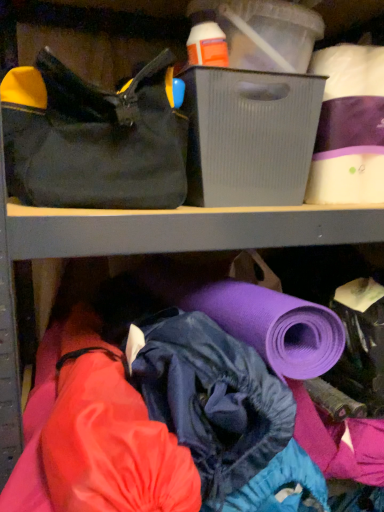
Question: Is white matte toilet paper at upper right bigger than gray ribbed plastic storage box at upper center?

Choices:
 (A) no
 (B) yes

Answer: (A)

Question: Is white matte toilet paper at upper right at the left side of gray ribbed plastic storage box at upper center?

Choices:
 (A) no
 (B) yes

Answer: (A)

Question: From a real-world perspective, is white matte toilet paper at upper right located beneath gray ribbed plastic storage box at upper center?

Choices:
 (A) no
 (B) yes

Answer: (A)

Question: Would you say white matte toilet paper at upper right is a long distance from gray ribbed plastic storage box at upper center?

Choices:
 (A) yes
 (B) no

Answer: (B)

Question: Can you confirm if white matte toilet paper at upper right is smaller than gray ribbed plastic storage box at upper center?

Choices:
 (A) yes
 (B) no

Answer: (A)

Question: Does white matte toilet paper at upper right come in front of gray ribbed plastic storage box at upper center?

Choices:
 (A) no
 (B) yes

Answer: (A)

Question: From a real-world perspective, is gray ribbed plastic storage box at upper center positioned over black canvas handbag at upper left based on gravity?

Choices:
 (A) yes
 (B) no

Answer: (B)

Question: Does gray ribbed plastic storage box at upper center have a greater height compared to black canvas handbag at upper left?

Choices:
 (A) yes
 (B) no

Answer: (B)

Question: From a real-world perspective, is gray ribbed plastic storage box at upper center located beneath black canvas handbag at upper left?

Choices:
 (A) no
 (B) yes

Answer: (B)

Question: Can you see gray ribbed plastic storage box at upper center touching black canvas handbag at upper left?

Choices:
 (A) yes
 (B) no

Answer: (B)

Question: Does gray ribbed plastic storage box at upper center have a greater width compared to black canvas handbag at upper left?

Choices:
 (A) no
 (B) yes

Answer: (A)

Question: Considering the relative sizes of gray ribbed plastic storage box at upper center and black canvas handbag at upper left in the image provided, is gray ribbed plastic storage box at upper center smaller than black canvas handbag at upper left?

Choices:
 (A) yes
 (B) no

Answer: (A)

Question: Considering the relative sizes of gray ribbed plastic storage box at upper center and white matte toilet paper at upper right in the image provided, is gray ribbed plastic storage box at upper center shorter than white matte toilet paper at upper right?

Choices:
 (A) yes
 (B) no

Answer: (A)